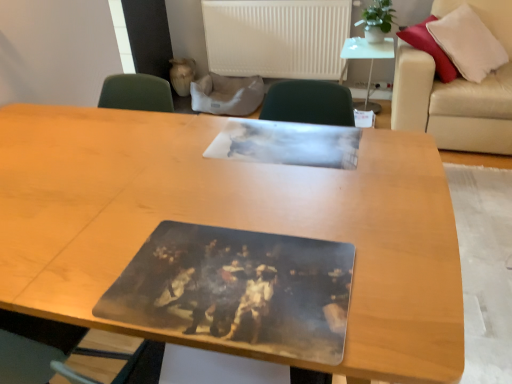
Question: From a real-world perspective, is beige leather couch at right physically above wooden table at center, the 1th table ordered from the bottom?

Choices:
 (A) yes
 (B) no

Answer: (A)

Question: Would you say wooden table at center, arranged as the 1th table when viewed from the front, is part of beige leather couch at right's contents?

Choices:
 (A) yes
 (B) no

Answer: (B)

Question: Is beige leather couch at right far from wooden table at center, positioned as the 2th table in right-to-left order?

Choices:
 (A) no
 (B) yes

Answer: (B)

Question: Considering the relative sizes of beige leather couch at right and wooden table at center, arranged as the 1th table when viewed from the front, in the image provided, is beige leather couch at right bigger than wooden table at center, arranged as the 1th table when viewed from the front,?

Choices:
 (A) no
 (B) yes

Answer: (A)

Question: Is beige leather couch at right positioned before wooden table at center, arranged as the 1th table when viewed from the front?

Choices:
 (A) yes
 (B) no

Answer: (B)

Question: Is beige leather couch at right located outside wooden table at center, marked as the 2th table in a back-to-front arrangement?

Choices:
 (A) yes
 (B) no

Answer: (A)

Question: Is beige leather couch at right positioned in front of wooden table at center, arranged as the second table when ordered from the bottom?

Choices:
 (A) yes
 (B) no

Answer: (A)

Question: Considering the relative sizes of beige leather couch at right and wooden table at center, arranged as the 1th table when viewed from the right, in the image provided, is beige leather couch at right thinner than wooden table at center, arranged as the 1th table when viewed from the right,?

Choices:
 (A) yes
 (B) no

Answer: (B)

Question: Is beige leather couch at right further to camera compared to wooden table at center, arranged as the second table when ordered from the bottom?

Choices:
 (A) yes
 (B) no

Answer: (B)

Question: Is beige leather couch at right taller than wooden table at center, which is the second table from left to right?

Choices:
 (A) yes
 (B) no

Answer: (A)

Question: Is beige leather couch at right next to wooden table at center, arranged as the 1th table when viewed from the right?

Choices:
 (A) yes
 (B) no

Answer: (B)

Question: Does beige leather couch at right contain wooden table at center, the first table positioned from the top?

Choices:
 (A) no
 (B) yes

Answer: (A)

Question: Considering the relative sizes of white matte radiator at upper center and beige leather couch at right in the image provided, is white matte radiator at upper center shorter than beige leather couch at right?

Choices:
 (A) yes
 (B) no

Answer: (A)